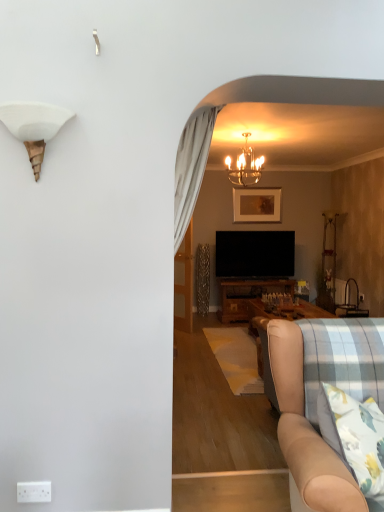
You are a GUI agent. You are given a task and a screenshot of the screen. Output one action in this format:
    pyautogui.click(x=<x>, y=<y>)
    Task: Click on the empty space that is ontop of translucent glass chandelier at upper center, which ranks as the first lamp in top-to-bottom order (from a real-world perspective)
    
    Given the screenshot: What is the action you would take?
    [250, 132]